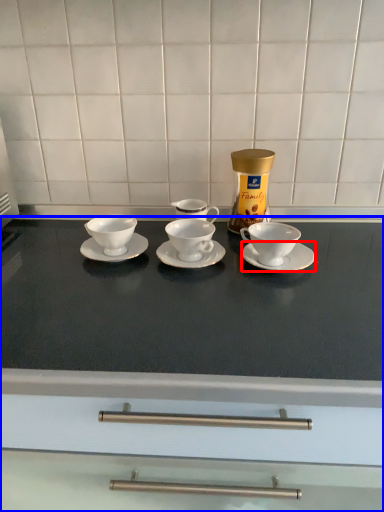
Question: Which of the following is the closest to the observer, saucer (highlighted by a red box) or countertop (highlighted by a blue box)?

Choices:
 (A) saucer
 (B) countertop

Answer: (B)